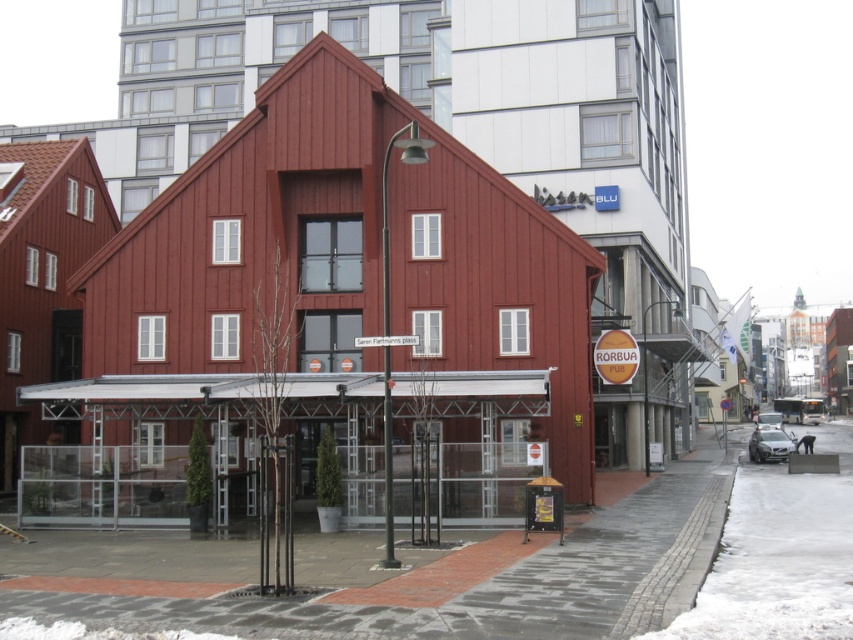
You are standing at the entrance of the RORBUA PUB and want to walk to the brick pavement at center. Which direction should you walk to reach it?

The brick pavement at center is located at point (392, 573), so you should walk towards the center of the image to reach it.

You are standing at the entrance of RORBUA PUB and want to walk to a specific location. You see two points marked in the scene. The first point is at coordinate point(468, 556) and the second point is at point(795, 477). Which point is closer to you as you face the building?

Point(468, 556) is closer to you because it is in front of point(795, 477).

You are a delivery person trying to reach the RORBUA PUB entrance. You see the brick pavement at center and the white powdery snow at lower right. Which path should you take to avoid stepping on snow?

You should take the brick pavement at center because it is located above the white powdery snow at lower right, meaning it is the path closer to the building and avoids the snow.